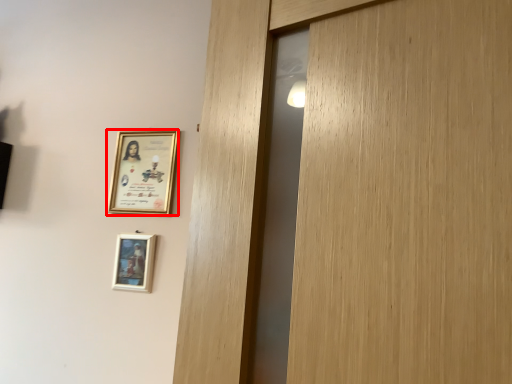
Question: From the image's perspective, where is picture frame (annotated by the red box) located relative to picture frame?

Choices:
 (A) below
 (B) above

Answer: (B)